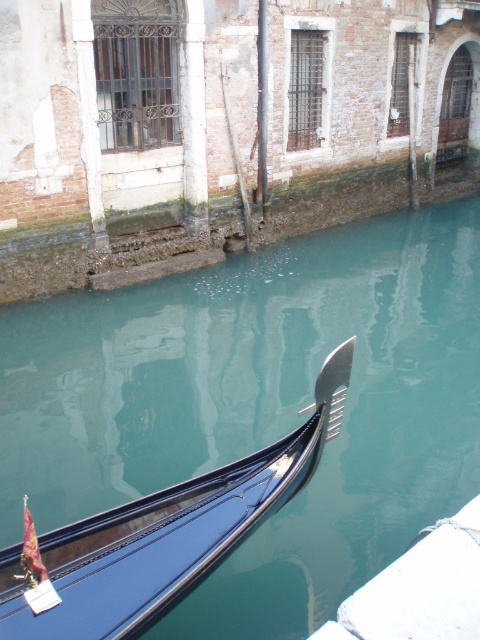
You are planning to take a photo of the canal. The scene has a glossy teal water at center and a shiny black gondola at lower left. Which object in the scene occupies a wider area in the photo?

The glossy teal water at center occupies a wider area in the photo because its width is larger than the shiny black gondola at lower left.

You are standing on a bridge overlooking the canal and want to take a photo of the shiny black gondola at lower left and the glossy teal water at center. Which object will appear larger in the photo?

The glossy teal water at center will appear larger in the photo because it is taller than the shiny black gondola at lower left.

You are standing on the dock and looking at the canal. You see the glossy teal water at center and the shiny black gondola at lower left. Which object is positioned higher relative to the other?

The glossy teal water at center is located above the shiny black gondola at lower left, so it is positioned higher.